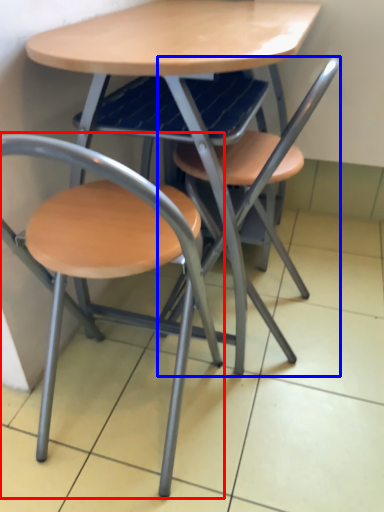
Question: Which point is further to the camera, chair (highlighted by a red box) or chair (highlighted by a blue box)?

Choices:
 (A) chair
 (B) chair

Answer: (B)